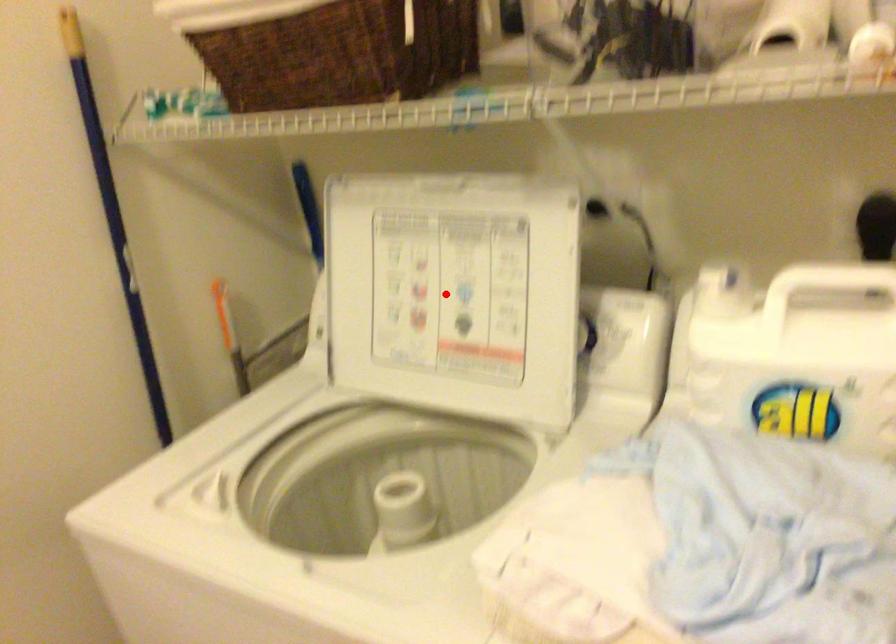
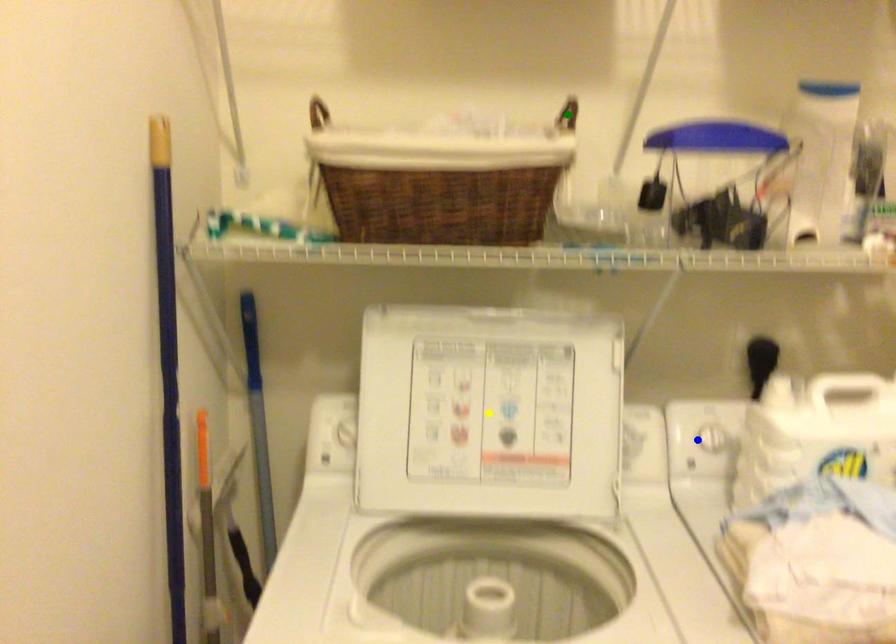
Question: I am providing you with two images of the same scene from different viewpoints. A red point is marked on the first image. You are given multiple points on the second image. In image 2, which mark is for the same physical point as the one in image 1?

Choices:
 (A) green point
 (B) blue point
 (C) yellow point

Answer: (C)